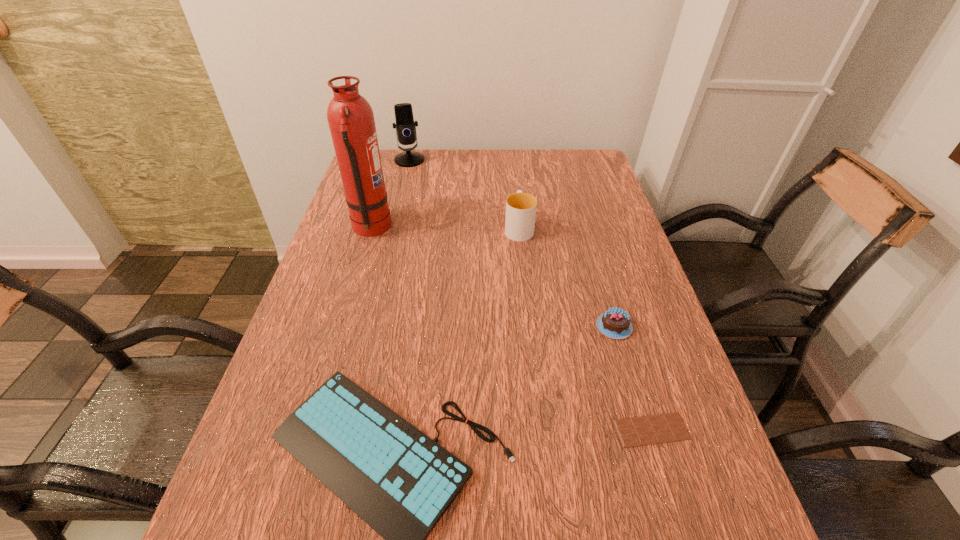
You are a GUI agent. You are given a task and a screenshot of the screen. Output one action in this format:
    pyautogui.click(x=<x>, y=<y>)
    Task: Click on the free space located with the handle on the side of the third tallest object
    This screenshot has height=540, width=960.
    Given the screenshot: What is the action you would take?
    pyautogui.click(x=511, y=155)

Image resolution: width=960 pixels, height=540 pixels. What are the coordinates of `vacant space located 0.400m with the handle on the side of the third tallest object` in the screenshot? It's located at (511, 151).

This screenshot has width=960, height=540. What are the coordinates of `vacant region located with the handle on the side of the third tallest object` in the screenshot? It's located at (516, 204).

What are the coordinates of `free space located 0.050m on the right of the chocolate cake` in the screenshot? It's located at (654, 327).

Identify the location of free space located 0.110m on the front of the chocolate bar. The image size is (960, 540). (677, 515).

What are the coordinates of `object located at the far edge` in the screenshot? It's located at (405, 125).

This screenshot has height=540, width=960. In order to click on fire extinguisher positioned at the left edge in this screenshot , I will do `click(350, 117)`.

Locate an element on the screen. microphone that is at the left edge is located at coordinates (405, 125).

The height and width of the screenshot is (540, 960). In order to click on chocolate cake present at the right edge in this screenshot , I will do `click(615, 323)`.

Where is `chocolate bar that is at the right edge`? Image resolution: width=960 pixels, height=540 pixels. chocolate bar that is at the right edge is located at coordinates (662, 428).